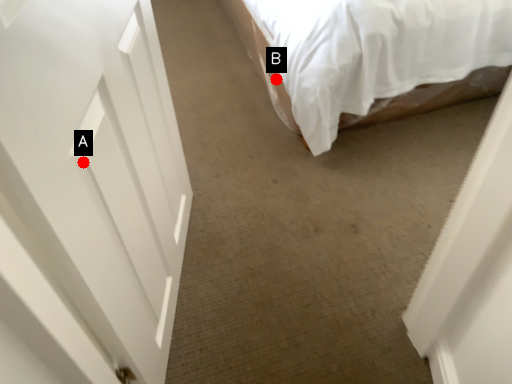
Question: Two points are circled on the image, labeled by A and B beside each circle. Which point is farther from the camera taking this photo?

Choices:
 (A) A is further
 (B) B is further

Answer: (B)